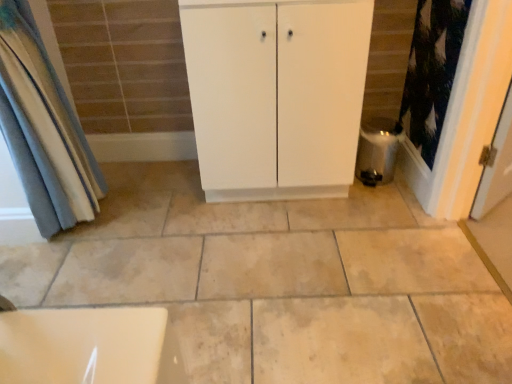
Find the location of a particular element. The width and height of the screenshot is (512, 384). vacant space in front of white matte cabinet at center is located at coordinates (282, 255).